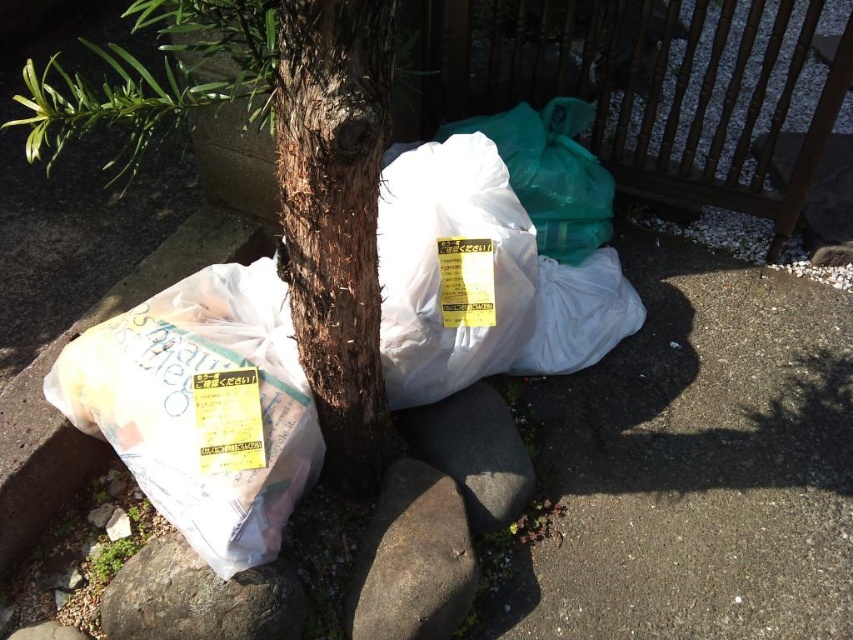
Question: Estimate the real-world distances between objects in this image. Which object is closer to the brown rough stone at lower center?

Choices:
 (A) gray rough stone at center
 (B) white plastic bag at lower left
 (C) gray rough stone at lower left

Answer: (A)

Question: Observing the image, what is the correct spatial positioning of white plastic bag at lower left in reference to gray rough stone at lower left?

Choices:
 (A) left
 (B) right

Answer: (A)

Question: Is brown rough stone at lower center below gray rough stone at center?

Choices:
 (A) no
 (B) yes

Answer: (B)

Question: Based on their relative distances, which object is farther from the white plastic bag at left?

Choices:
 (A) brown rough stone at lower center
 (B) gray rough stone at lower left
 (C) brown rough bark tree at center

Answer: (A)

Question: Does brown rough stone at lower center have a larger size compared to gray rough stone at center?

Choices:
 (A) yes
 (B) no

Answer: (B)

Question: Among these points, which one is nearest to the camera?

Choices:
 (A) (227, 365)
 (B) (337, 275)

Answer: (B)